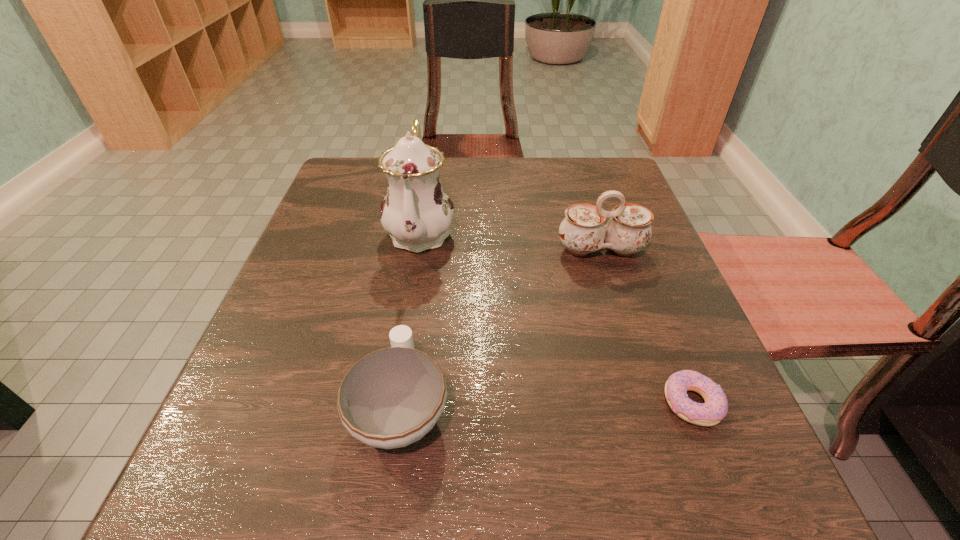
In order to click on vacant area that lies between the second shortest chinaware and the tallest object in this screenshot , I will do `click(511, 240)`.

Identify the location of vacant region between the shortest object and the second shortest chinaware. This screenshot has height=540, width=960. (646, 326).

Find the location of `vacant space that's between the tallest chinaware and the rightmost chinaware`. vacant space that's between the tallest chinaware and the rightmost chinaware is located at coordinates (511, 240).

Select which object appears as the second closest to the shortest chinaware. Please provide its 2D coordinates. Your answer should be formatted as a tuple, i.e. [(x, y)], where the tuple contains the x and y coordinates of a point satisfying the conditions above.

[(582, 231)]

Choose which object is the nearest neighbor to the tallest chinaware. Please provide its 2D coordinates. Your answer should be formatted as a tuple, i.e. [(x, y)], where the tuple contains the x and y coordinates of a point satisfying the conditions above.

[(582, 231)]

Locate an element on the screen. The image size is (960, 540). the closest chinaware relative to the tallest chinaware is located at coordinates (582, 231).

What are the coordinates of `the second closest chinaware to the doughnut` in the screenshot? It's located at (391, 398).

Where is `free location that satisfies the following two spatial constraints: 1. on the side with the handle of the second shortest object; 2. on the left side of the shortest object`? The width and height of the screenshot is (960, 540). free location that satisfies the following two spatial constraints: 1. on the side with the handle of the second shortest object; 2. on the left side of the shortest object is located at coordinates (401, 403).

This screenshot has width=960, height=540. What are the coordinates of `vacant point that satisfies the following two spatial constraints: 1. on the front side of the tallest chinaware; 2. on the left side of the shortest object` in the screenshot? It's located at (393, 403).

Locate an element on the screen. The height and width of the screenshot is (540, 960). free point that satisfies the following two spatial constraints: 1. on the side with the handle of the doughnut; 2. on the left side of the nearest chinaware is located at coordinates (401, 403).